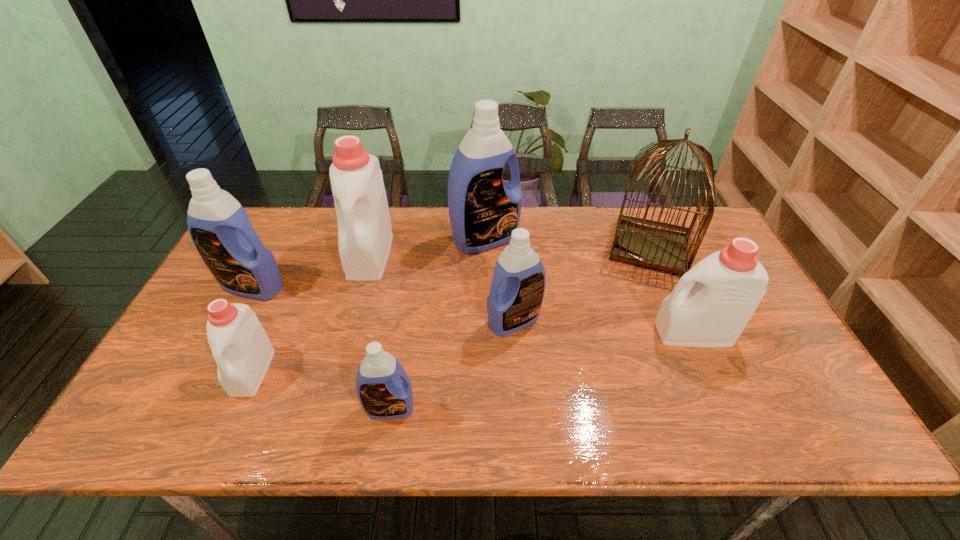
Where is `vacant region at the near edge of the desktop`? The width and height of the screenshot is (960, 540). vacant region at the near edge of the desktop is located at coordinates (479, 442).

Where is `vacant space at the near right corner of the desktop`? vacant space at the near right corner of the desktop is located at coordinates (782, 440).

The width and height of the screenshot is (960, 540). In order to click on free space between the fourth detergent from left to right and the second smallest blue detergent in this screenshot , I will do `click(452, 364)`.

The height and width of the screenshot is (540, 960). In order to click on free spot between the tallest detergent and the birdcage in this screenshot , I will do `click(567, 243)`.

This screenshot has height=540, width=960. In order to click on free space between the leftmost white detergent and the third blue detergent from right to left in this screenshot , I will do `click(321, 390)`.

Where is `vacant space in between the rightmost white detergent and the leftmost blue detergent`? This screenshot has height=540, width=960. vacant space in between the rightmost white detergent and the leftmost blue detergent is located at coordinates (473, 309).

The image size is (960, 540). In order to click on vacant space that is in between the birdcage and the third biggest blue detergent in this screenshot , I will do `click(582, 284)`.

Identify the location of free space between the smallest blue detergent and the second white detergent from left to right. (380, 332).

Locate an element on the screen. vacant area between the smallest white detergent and the birdcage is located at coordinates (451, 309).

Where is `object that stands as the second closest to the biggest white detergent`? This screenshot has height=540, width=960. object that stands as the second closest to the biggest white detergent is located at coordinates (483, 210).